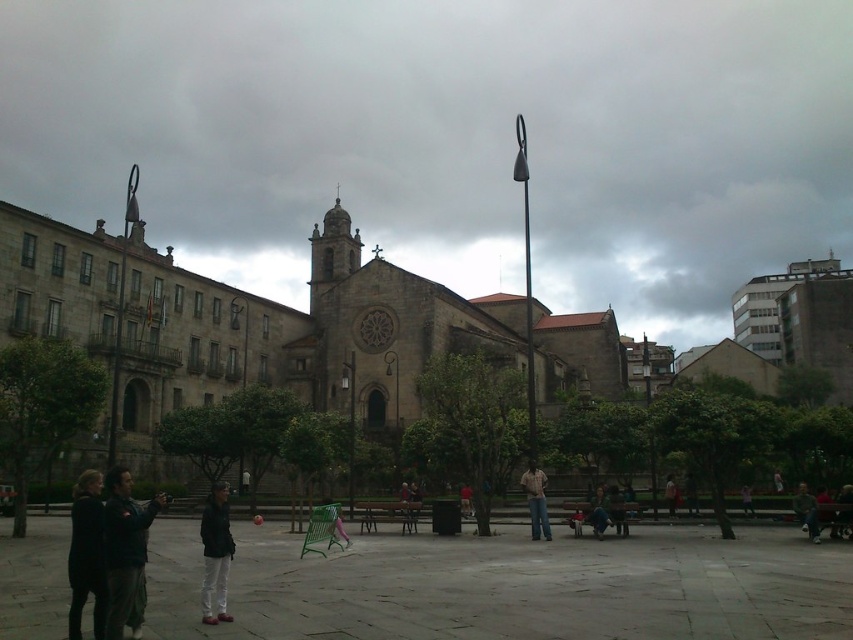
Question: Estimate the real-world distances between objects in this image. Which object is closer to the red fabric jacket at center?

Choices:
 (A) dark gray fabric jacket at center
 (B) dark gray jacket at lower left

Answer: (A)

Question: Is matte stone building at center closer to the viewer compared to dark gray jacket at center?

Choices:
 (A) yes
 (B) no

Answer: (B)

Question: Can you confirm if dark gray jacket at center is positioned to the right of dark gray pants at center?

Choices:
 (A) no
 (B) yes

Answer: (A)

Question: Which object is positioned farthest from the brown cotton shirt at center?

Choices:
 (A) purple fabric dress at center
 (B) green fabric jacket at lower right

Answer: (A)

Question: Which object is positioned closest to the red fabric jacket at center?

Choices:
 (A) dark green jacket at lower left
 (B) green fabric jacket at lower right
 (C) dark gray fabric jacket at center

Answer: (B)

Question: Is brown cotton shirt at center thinner than dark gray pants at center?

Choices:
 (A) yes
 (B) no

Answer: (B)